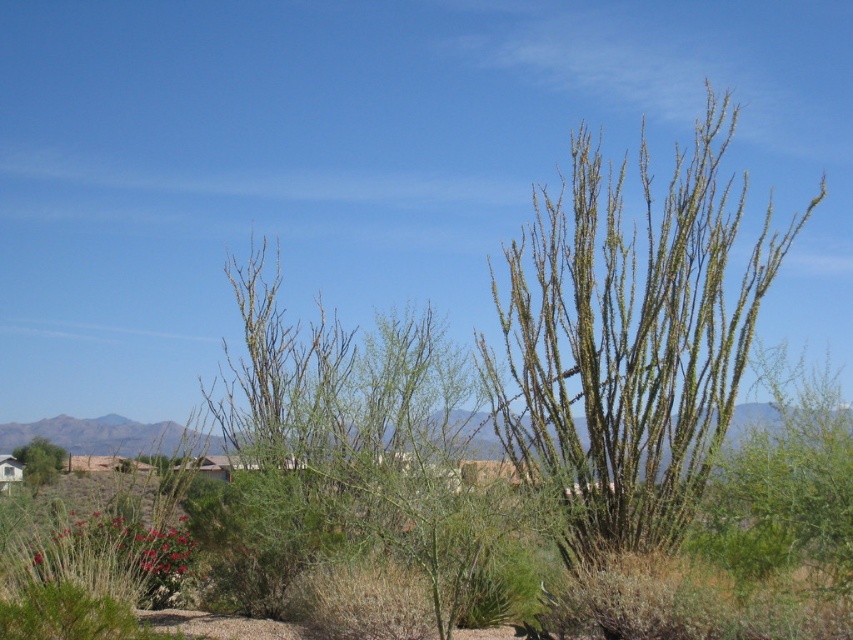
You are a desert explorer trying to navigate between two green spiny bushes. You see the green spiny bush at center and the green spiny bush at lower left. Which one is closer to you?

The green spiny bush at lower left is closer to you because it is positioned lower in the image, which typically indicates proximity in such landscapes.